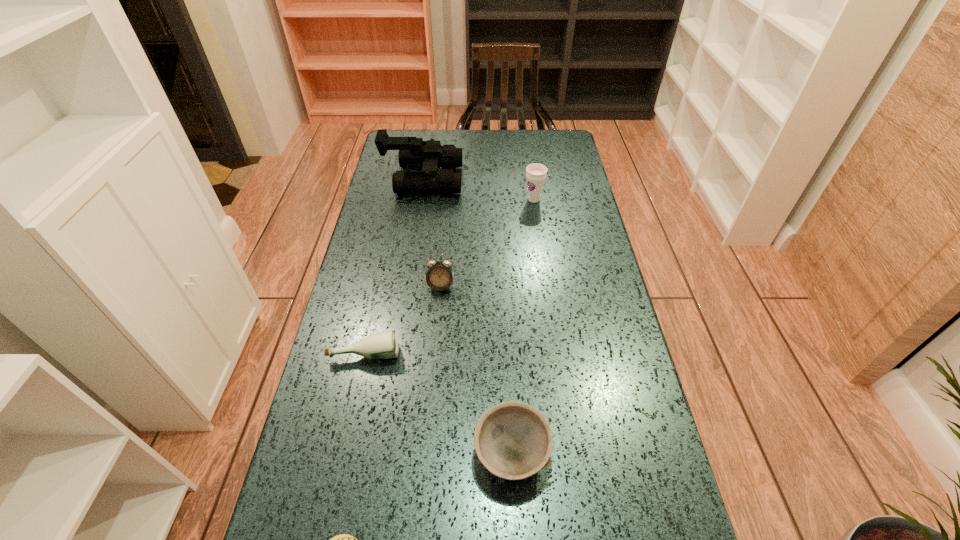
You are a GUI agent. You are given a task and a screenshot of the screen. Output one action in this format:
    pyautogui.click(x=<x>, y=<y>)
    Task: Click on the tallest object
    This screenshot has width=960, height=540.
    Given the screenshot: What is the action you would take?
    pyautogui.click(x=414, y=153)

Where is `the second tallest object`? Image resolution: width=960 pixels, height=540 pixels. the second tallest object is located at coordinates (536, 173).

Where is `cup`? The width and height of the screenshot is (960, 540). cup is located at coordinates (536, 173).

The width and height of the screenshot is (960, 540). In order to click on the fourth nearest object in this screenshot , I will do `click(439, 276)`.

At what (x,y) coordinates should I click in order to perform the action: click on the third tallest object. Please return your answer as a coordinate pair (x, y). Image resolution: width=960 pixels, height=540 pixels. Looking at the image, I should click on (439, 276).

Locate an element on the screen. the third shortest object is located at coordinates (513, 440).

Locate an element on the screen. Image resolution: width=960 pixels, height=540 pixels. bowl is located at coordinates (513, 440).

You are a GUI agent. You are given a task and a screenshot of the screen. Output one action in this format:
    pyautogui.click(x=<x>, y=<y>)
    Task: Click on the bottle
    This screenshot has height=540, width=960.
    Given the screenshot: What is the action you would take?
    pyautogui.click(x=383, y=345)

Where is `the third nearest object`? the third nearest object is located at coordinates (383, 345).

This screenshot has width=960, height=540. Find the location of `vacant region located on the front lenses of the binoculars`. vacant region located on the front lenses of the binoculars is located at coordinates (513, 180).